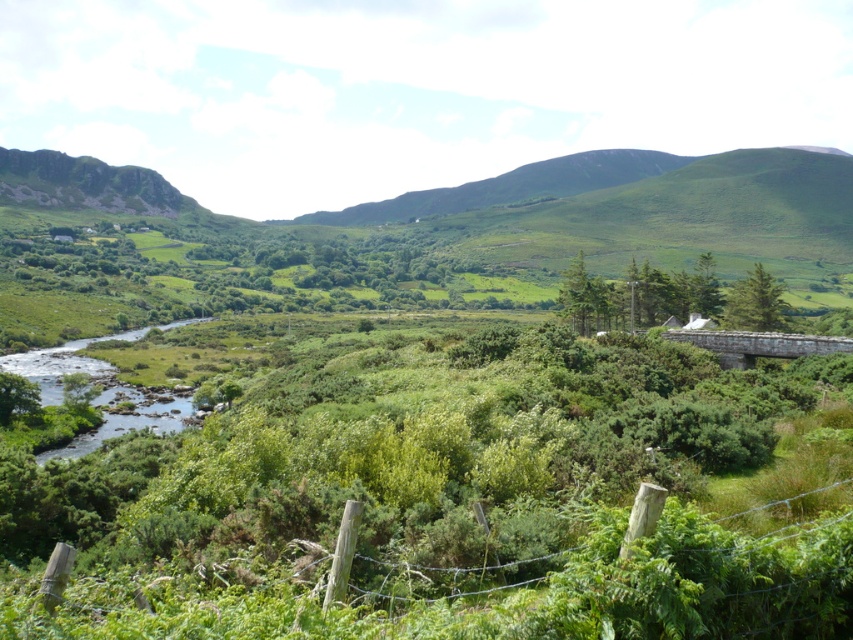
Question: Can you confirm if green leafy tree at center is wider than green matte tree at center?

Choices:
 (A) yes
 (B) no

Answer: (A)

Question: In this image, where is green leafy tree at center located relative to green matte tree at center?

Choices:
 (A) above
 (B) below

Answer: (A)

Question: Which object appears farthest from the camera in this image?

Choices:
 (A) green matte tree at center
 (B) green leafy tree at right
 (C) green leafy tree at center

Answer: (A)

Question: Is the position of green leafy tree at center less distant than that of green leafy tree at right?

Choices:
 (A) yes
 (B) no

Answer: (B)

Question: Which object is closer to the camera taking this photo?

Choices:
 (A) green leafy tree at right
 (B) green matte tree at center
 (C) green leafy tree at center

Answer: (A)

Question: Which point is closer to the camera?

Choices:
 (A) (601, 291)
 (B) (759, 298)

Answer: (B)